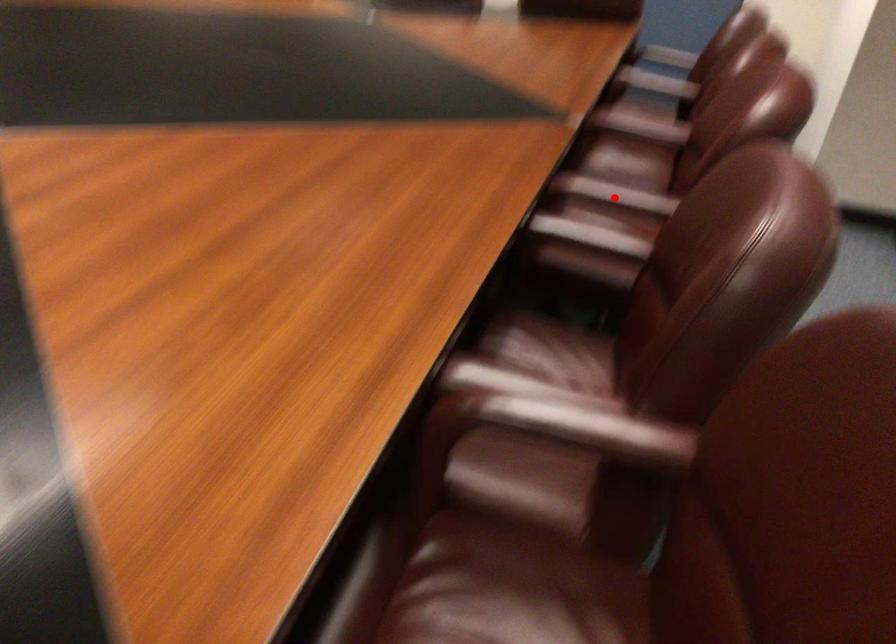
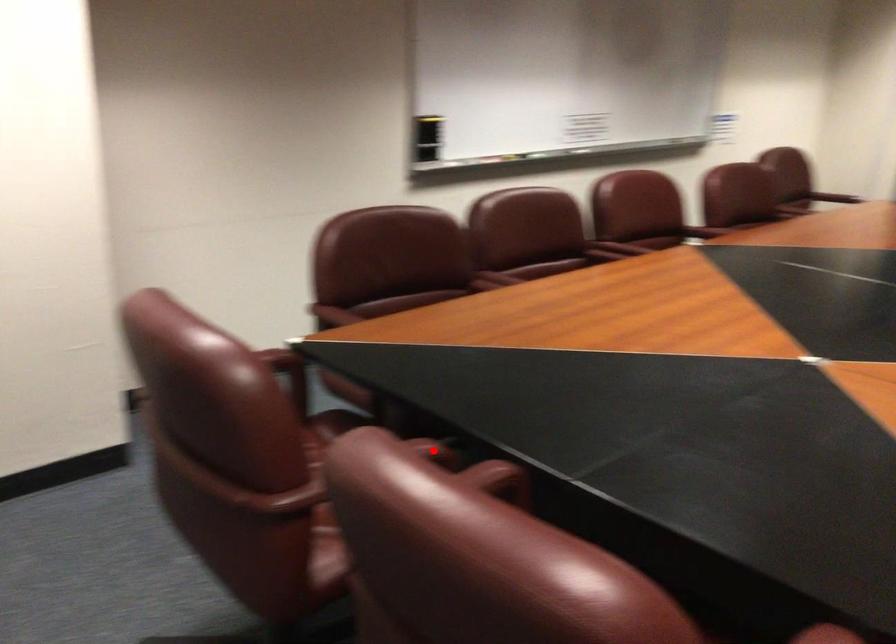
I am providing you with two images of the same scene from different viewpoints. A red point is marked on the first image and another point is marked on the second image. Are the points marked in image1 and image2 representing the same 3D position?

No